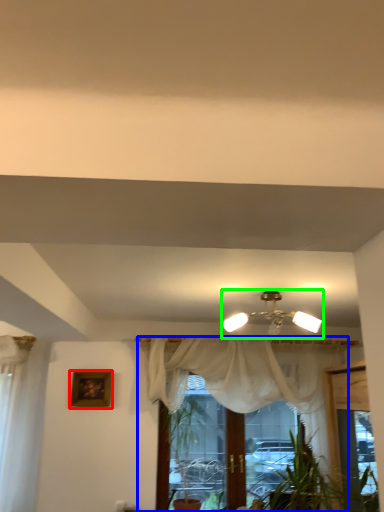
Question: Considering the real-world distances, which object is farthest from picture frame (highlighted by a red box)? curtain (highlighted by a blue box) or lamp (highlighted by a green box)?

Choices:
 (A) curtain
 (B) lamp

Answer: (B)